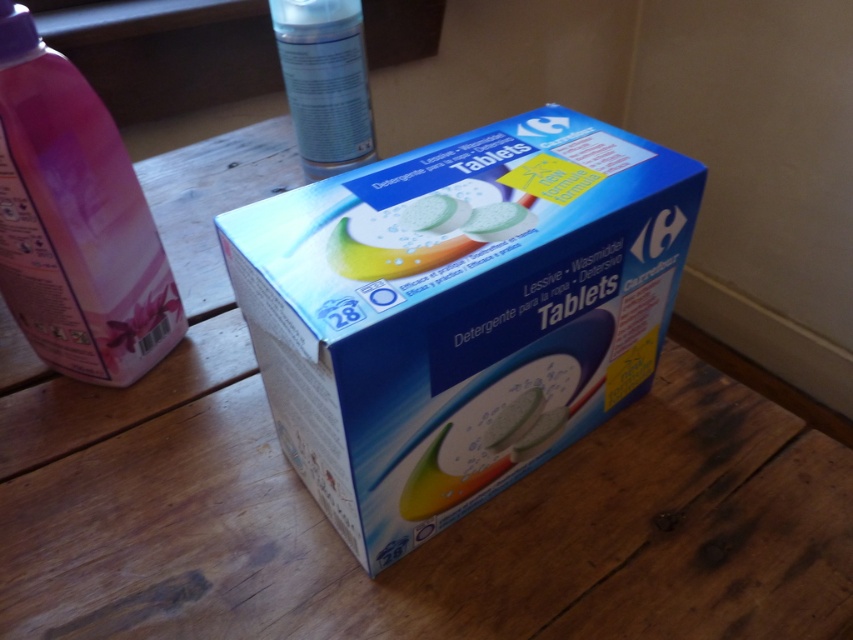
Question: Is pink plastic bottle at left thinner than translucent plastic tablets at center?

Choices:
 (A) yes
 (B) no

Answer: (B)

Question: Does pink plastic bottle at left come behind translucent plastic tablets at center?

Choices:
 (A) no
 (B) yes

Answer: (B)

Question: Among these objects, which one is nearest to the camera?

Choices:
 (A) blue cardboard box at center
 (B) pink plastic bottle at left
 (C) translucent plastic tablets at center
 (D) transparent plastic spray can at upper center

Answer: (A)

Question: Does blue cardboard box at center appear on the left side of transparent plastic spray can at upper center?

Choices:
 (A) yes
 (B) no

Answer: (B)

Question: Estimate the real-world distances between objects in this image. Which object is farther from the transparent plastic spray can at upper center?

Choices:
 (A) pink plastic bottle at left
 (B) blue cardboard box at center
 (C) translucent plastic tablets at center

Answer: (C)

Question: Which point is farther to the camera?

Choices:
 (A) blue cardboard box at center
 (B) pink plastic bottle at left
 (C) transparent plastic spray can at upper center

Answer: (C)